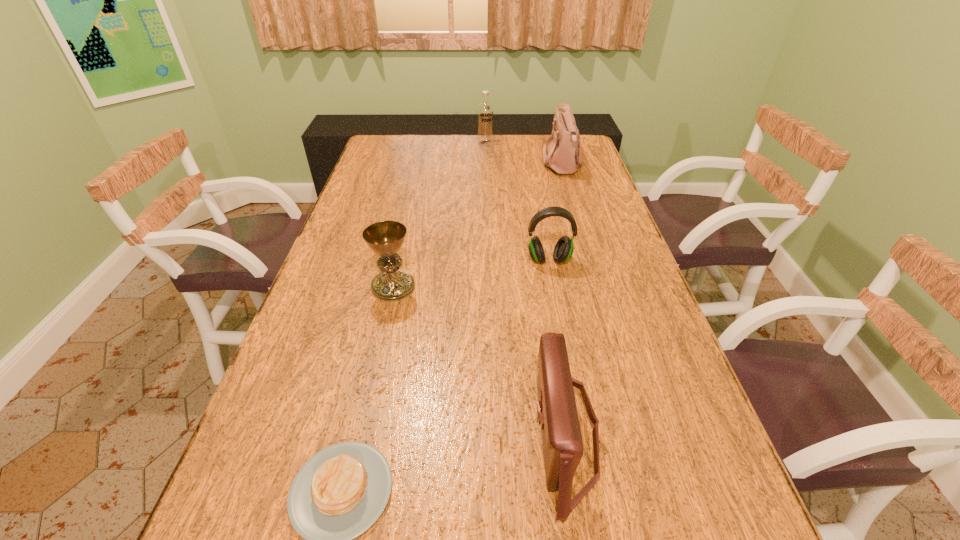
Where is `object that is the closest to the headset`? object that is the closest to the headset is located at coordinates (385, 238).

Identify which object is the second closest to the fourth farthest object. Please provide its 2D coordinates. Your answer should be formatted as a tuple, i.e. [(x, y)], where the tuple contains the x and y coordinates of a point satisfying the conditions above.

[(557, 413)]